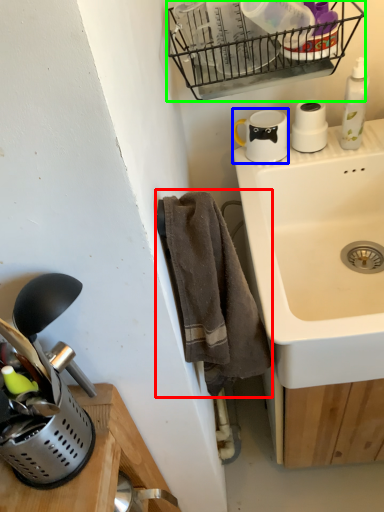
Question: Estimate the real-world distances between objects in this image. Which object is closer to bath towel (highlighted by a red box), appliance (highlighted by a blue box) or basket (highlighted by a green box)?

Choices:
 (A) appliance
 (B) basket

Answer: (A)